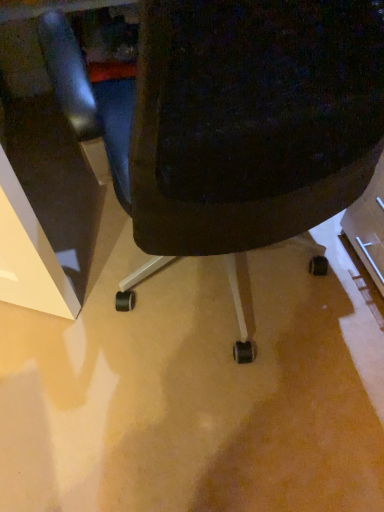
This screenshot has width=384, height=512. In order to click on free spot in front of black fabric chair at center in this screenshot , I will do `click(220, 443)`.